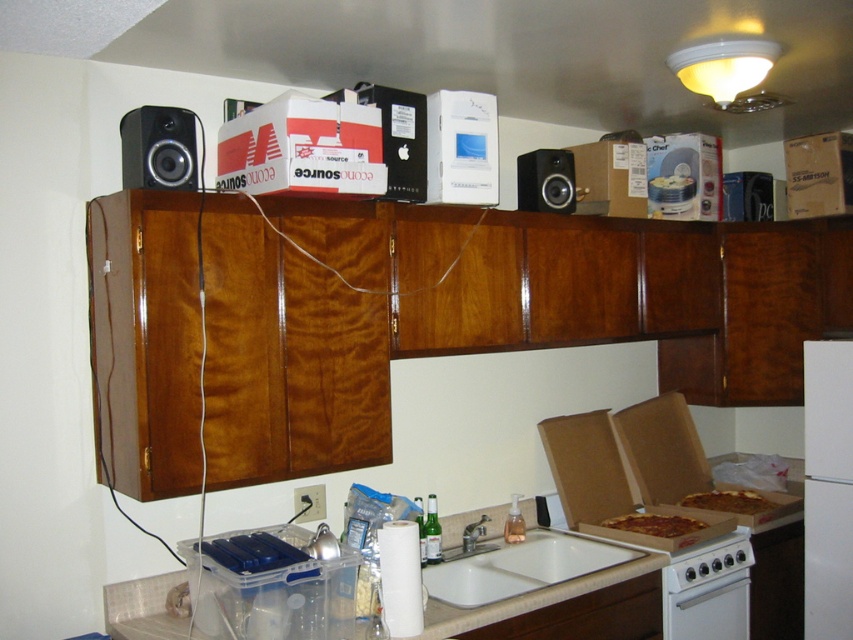
Question: Considering the relative positions of white ceramic sink at lower center and matte black speaker at upper center in the image provided, where is white ceramic sink at lower center located with respect to matte black speaker at upper center?

Choices:
 (A) below
 (B) above

Answer: (A)

Question: Which object is closer to the camera taking this photo?

Choices:
 (A) matte black speaker at upper left
 (B) white ceramic sink at lower center

Answer: (A)

Question: Is white glossy oven at lower right wider than golden crispy pizza at lower right?

Choices:
 (A) yes
 (B) no

Answer: (A)

Question: Which of the following is the closest to the observer?

Choices:
 (A) white ceramic sink at lower center
 (B) matte black speaker at upper center

Answer: (A)

Question: Estimate the real-world distances between objects in this image. Which object is farther from the white glossy counter top at lower center?

Choices:
 (A) white glossy oven at lower right
 (B) matte black speaker at upper left
 (C) matte black speaker at upper center

Answer: (B)

Question: Can you confirm if white glossy oven at lower right is bigger than golden crispy pizza at lower right?

Choices:
 (A) yes
 (B) no

Answer: (A)